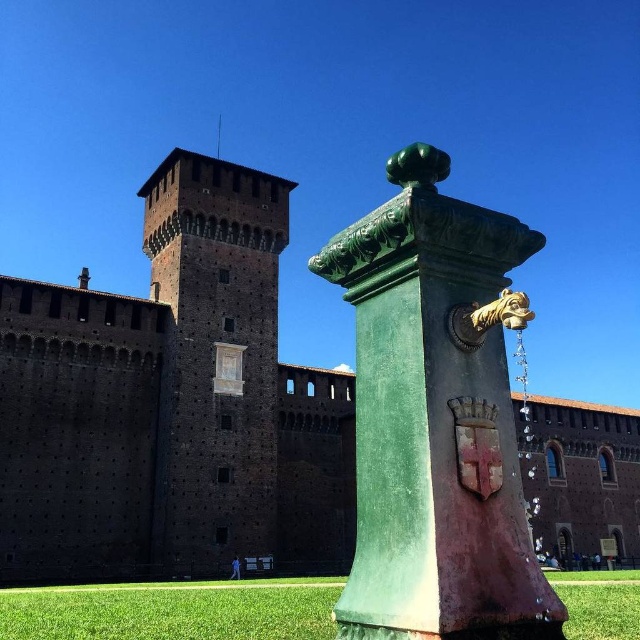
Question: Which point is closer to the camera taking this photo?

Choices:
 (A) (132, 637)
 (B) (449, 552)
 (C) (118, 570)

Answer: (B)

Question: Can you confirm if dark brown stone tower at center is smaller than green grass at lower center?

Choices:
 (A) yes
 (B) no

Answer: (A)

Question: Is dark brown stone tower at center below green grass at lower center?

Choices:
 (A) yes
 (B) no

Answer: (B)

Question: Which point appears farthest from the camera in this image?

Choices:
 (A) (224, 211)
 (B) (609, 499)
 (C) (632, 628)
 (D) (449, 616)

Answer: (B)

Question: Considering the real-world distances, which object is farthest from the dark brown stone tower at center?

Choices:
 (A) green grass at lower center
 (B) green patinated metal fountain at center

Answer: (B)

Question: Is green patinated metal fountain at center bigger than dark brown stone tower at center?

Choices:
 (A) no
 (B) yes

Answer: (A)